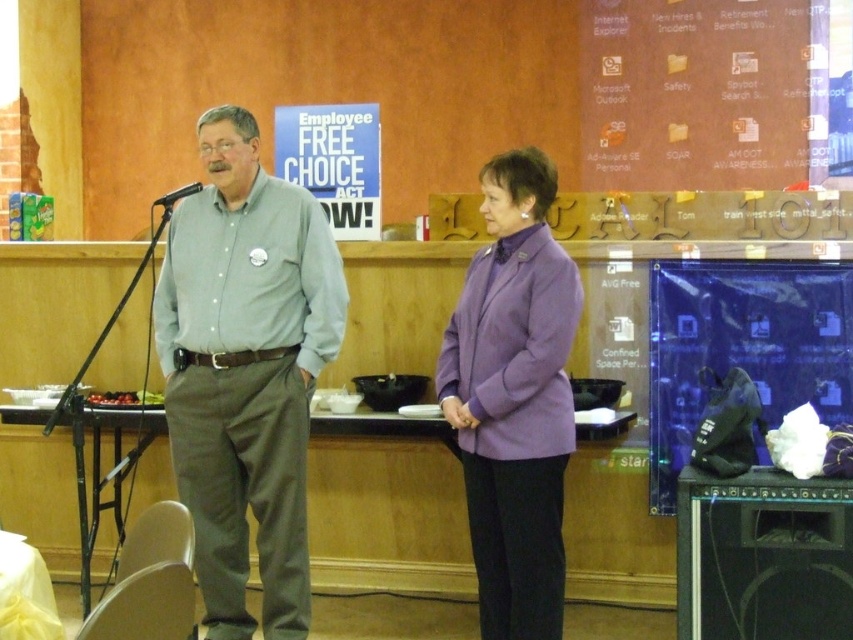
Question: Which point is farther from the camera taking this photo?

Choices:
 (A) tap(262, 472)
 (B) tap(483, 356)
 (C) tap(109, 394)

Answer: (C)

Question: Estimate the real-world distances between objects in this image. Which object is closer to the shiny red grapes at lower left?

Choices:
 (A) gray cotton shirt at center
 (B) purple fabric jacket at center

Answer: (A)

Question: Which of the following is the farthest from the observer?

Choices:
 (A) (254, 506)
 (B) (184, 192)
 (C) (520, 512)

Answer: (B)

Question: Is gray cotton shirt at center positioned in front of purple fabric jacket at center?

Choices:
 (A) yes
 (B) no

Answer: (B)

Question: Can you confirm if gray cotton shirt at center is smaller than black metallic microphone at left?

Choices:
 (A) yes
 (B) no

Answer: (B)

Question: From the image, what is the correct spatial relationship of shiny red grapes at lower left in relation to black metallic microphone at left?

Choices:
 (A) below
 (B) above

Answer: (A)